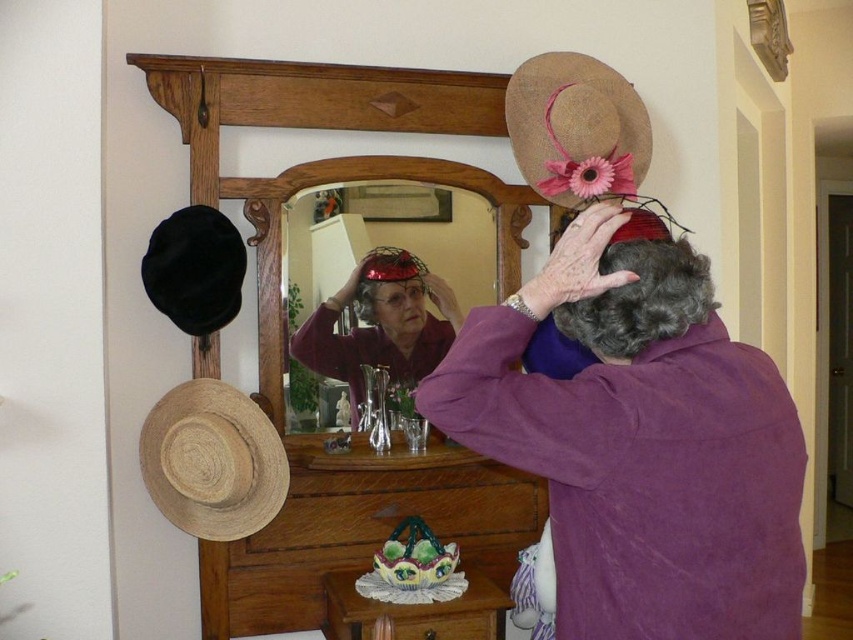
Question: Does purple matte shirt at center have a greater width compared to natural straw hat at left?

Choices:
 (A) no
 (B) yes

Answer: (B)

Question: Is matte plastic mirror at center above gray curly hair at upper center?

Choices:
 (A) no
 (B) yes

Answer: (B)

Question: Among these objects, which one is farthest from the camera?

Choices:
 (A) natural straw hat at left
 (B) gray curly hair at upper center
 (C) wooden dresser at center

Answer: (C)

Question: Which object is closer to the camera taking this photo?

Choices:
 (A) brown straw cowboy hat at upper center
 (B) gray curly hair at upper center
 (C) matte red helmet at center

Answer: (B)

Question: Observing the image, what is the correct spatial positioning of wooden dresser at center in reference to matte plastic mirror at center?

Choices:
 (A) below
 (B) above

Answer: (B)

Question: Which is farther from the purple matte shirt at center?

Choices:
 (A) wooden dresser at center
 (B) matte plastic mirror at center
 (C) wooden drawer at lower center

Answer: (A)